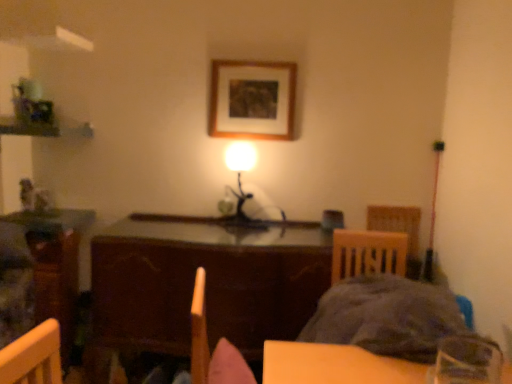
Question: Does fluffy gray blanket at lower right have a greater height compared to matte brown armchair at center?

Choices:
 (A) no
 (B) yes

Answer: (B)

Question: From a real-world perspective, does fluffy gray blanket at lower right stand above matte brown armchair at center?

Choices:
 (A) yes
 (B) no

Answer: (B)

Question: Would you say matte brown armchair at center is part of fluffy gray blanket at lower right's contents?

Choices:
 (A) yes
 (B) no

Answer: (B)

Question: From the image's perspective, does fluffy gray blanket at lower right appear lower than matte brown armchair at center?

Choices:
 (A) no
 (B) yes

Answer: (B)

Question: Does fluffy gray blanket at lower right turn towards matte brown armchair at center?

Choices:
 (A) yes
 (B) no

Answer: (B)

Question: Considering the relative sizes of fluffy gray blanket at lower right and matte brown armchair at center in the image provided, is fluffy gray blanket at lower right shorter than matte brown armchair at center?

Choices:
 (A) no
 (B) yes

Answer: (A)

Question: Is fluffy gray blanket at lower right oriented away from wooden table at left, the second table viewed from the right?

Choices:
 (A) yes
 (B) no

Answer: (B)

Question: Is fluffy gray blanket at lower right in contact with wooden table at left, which is counted as the first table, starting from the left?

Choices:
 (A) no
 (B) yes

Answer: (A)

Question: Does fluffy gray blanket at lower right have a lesser height compared to wooden table at left, which is counted as the first table, starting from the left?

Choices:
 (A) no
 (B) yes

Answer: (B)

Question: From the image's perspective, is fluffy gray blanket at lower right below wooden table at left, the second table viewed from the right?

Choices:
 (A) no
 (B) yes

Answer: (A)

Question: Does fluffy gray blanket at lower right have a larger size compared to wooden table at left, which is counted as the first table, starting from the left?

Choices:
 (A) yes
 (B) no

Answer: (A)

Question: Is the position of fluffy gray blanket at lower right less distant than that of wooden table at left, which is counted as the first table, starting from the left?

Choices:
 (A) no
 (B) yes

Answer: (B)

Question: Does wooden table at left, the second table viewed from the right, have a smaller size compared to matte brown armchair at center?

Choices:
 (A) no
 (B) yes

Answer: (A)